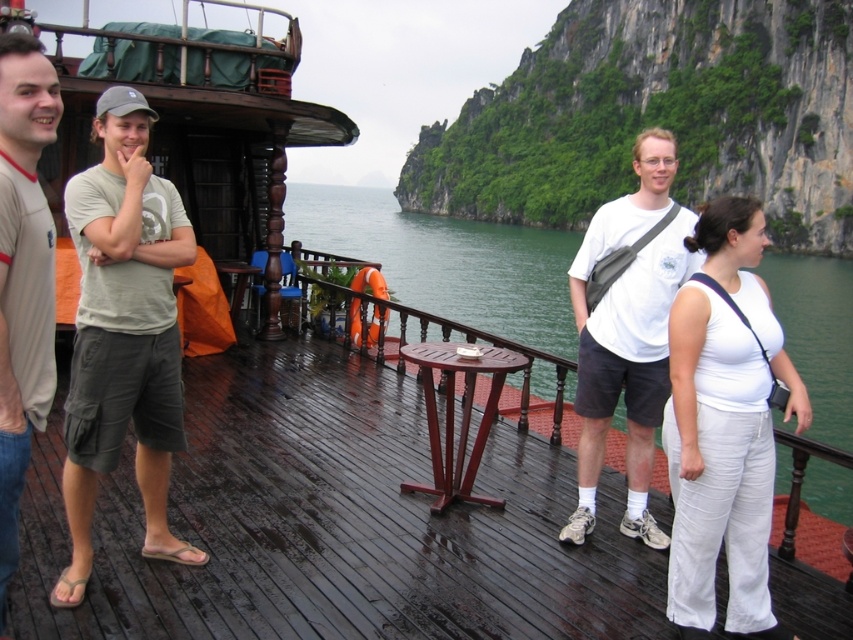
Is white cotton pants at center positioned at the back of white matte shirt at center?

No, it is in front of white matte shirt at center.

Can you confirm if white cotton pants at center is positioned to the left of white matte shirt at center?

In fact, white cotton pants at center is to the right of white matte shirt at center.

Between point (709, 449) and point (593, 353), which one is positioned behind?

Point (593, 353)

Find the location of `white cotton pants at center`. white cotton pants at center is located at coordinates (724, 426).

From the picture: Can you confirm if green water at center is wider than white matte shirt at center?

Correct, the width of green water at center exceeds that of white matte shirt at center.

Is green water at center taller than white matte shirt at center?

Indeed, green water at center has a greater height compared to white matte shirt at center.

Is point (325, 228) closer to viewer compared to point (613, 291)?

No, (325, 228) is behind (613, 291).

The height and width of the screenshot is (640, 853). I want to click on green water at center, so click(x=447, y=260).

Is wooden deck at center to the right of light brown t-shirt at left from the viewer's perspective?

Indeed, wooden deck at center is positioned on the right side of light brown t-shirt at left.

Is point (109, 497) positioned in front of point (12, 211)?

No, (109, 497) is further to viewer.

Locate an element on the screen. This screenshot has height=640, width=853. wooden deck at center is located at coordinates (332, 522).